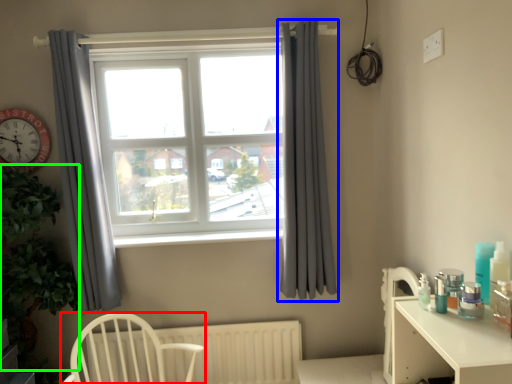
Question: Which object is positioned farthest from chair (highlighted by a red box)? Select from curtain (highlighted by a blue box) and plant (highlighted by a green box).

Choices:
 (A) curtain
 (B) plant

Answer: (A)